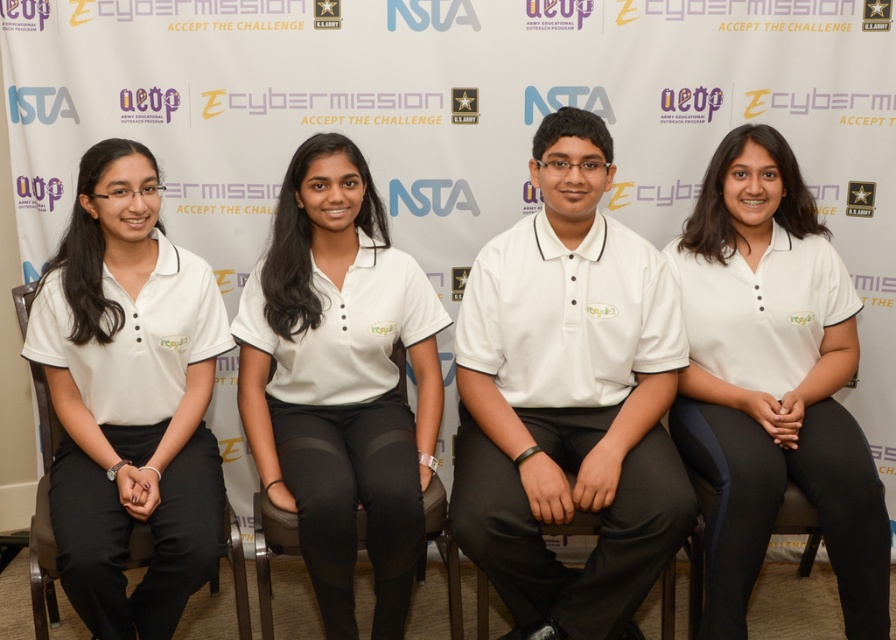
Question: Is white matte shirt at left above white matte uniform at center?

Choices:
 (A) no
 (B) yes

Answer: (B)

Question: Among these points, which one is farthest from the camera?

Choices:
 (A) (734, 332)
 (B) (177, 522)

Answer: (A)

Question: Is white matte polo shirt at right wider than white matte shirt at left?

Choices:
 (A) yes
 (B) no

Answer: (B)

Question: Which of the following is the closest to the observer?

Choices:
 (A) white matte uniform at center
 (B) white cotton shirt at center
 (C) white matte shirt at left

Answer: (C)

Question: Which object is closer to the camera taking this photo?

Choices:
 (A) white matte polo shirt at right
 (B) white cotton shirt at center
 (C) white matte uniform at center

Answer: (C)

Question: Where is white cotton shirt at center located in relation to white matte shirt at left in the image?

Choices:
 (A) below
 (B) above

Answer: (B)